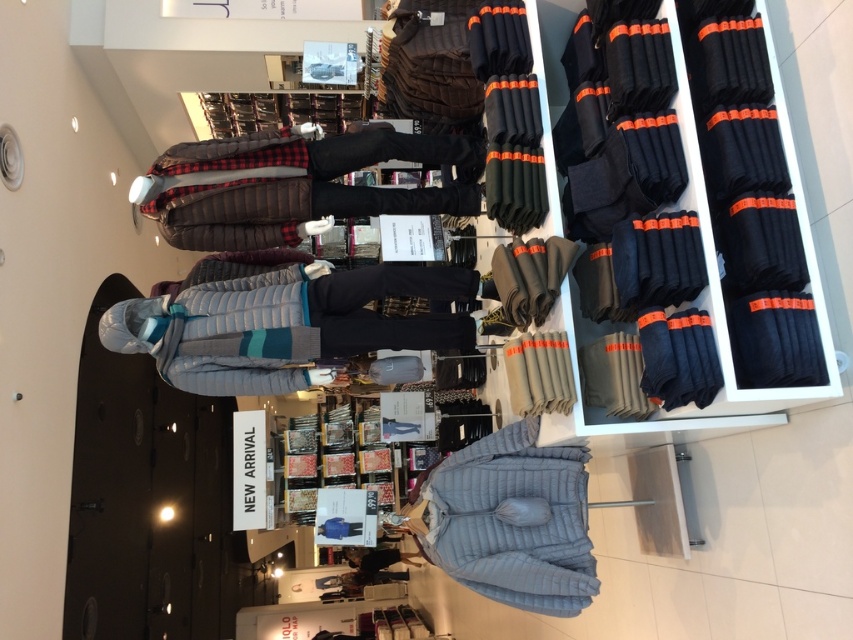
You are a store employee who needs to place a new display stand that is 1.2 meters wide between the light gray quilted jacket at center and the brown quilted jacket at center. Based on their widths, will the display stand fit between them?

The light gray quilted jacket at center might be wider than brown quilted jacket at center, so there is uncertainty about whether the display stand will fit. It is recommended to measure the space between them first before placing the stand.

You are a customer in the store and want to try on the light gray quilted jacket at center and the dark gray fleece pants at center. Which item should you pick up first if you want to reach the one on the left side first?

The light gray quilted jacket at center is to the left of the dark gray fleece pants at center, so you should pick up the light gray quilted jacket at center first.

You are a store employee who needs to place a new rack that is 50 centimeters wide between the light gray quilted jacket at center and the brown quilted jacket at center. Based on the current spacing between them, will the rack fit without moving any jackets?

The distance between the light gray quilted jacket at center and the brown quilted jacket at center is 48.02 centimeters. Since the rack is 50 centimeters wide, it will not fit as the available space is narrower than the rack.